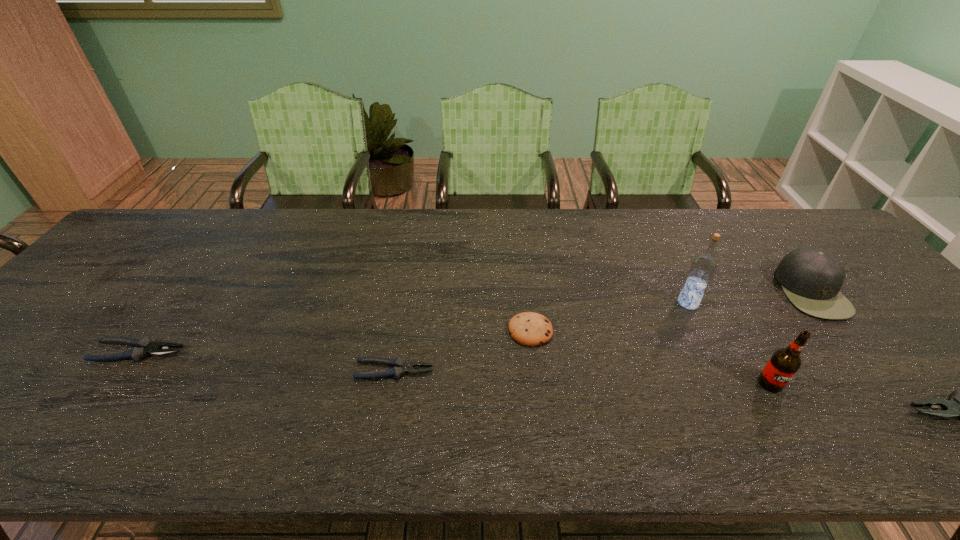
Identify the location of the second shortest pliers. (143, 347).

This screenshot has height=540, width=960. In order to click on the leftmost pliers in this screenshot , I will do `click(143, 347)`.

Where is `the shortest object`? Image resolution: width=960 pixels, height=540 pixels. the shortest object is located at coordinates (400, 367).

I want to click on the shortest pliers, so click(400, 367).

The width and height of the screenshot is (960, 540). Find the location of `cap`. cap is located at coordinates (811, 278).

The image size is (960, 540). I want to click on the fourth object from left to right, so click(703, 267).

Locate an element on the screen. the tallest object is located at coordinates (703, 267).

I want to click on the fifth object from right to left, so click(x=530, y=329).

The height and width of the screenshot is (540, 960). I want to click on the second tallest object, so click(784, 363).

Where is `root beer`? This screenshot has height=540, width=960. root beer is located at coordinates (784, 363).